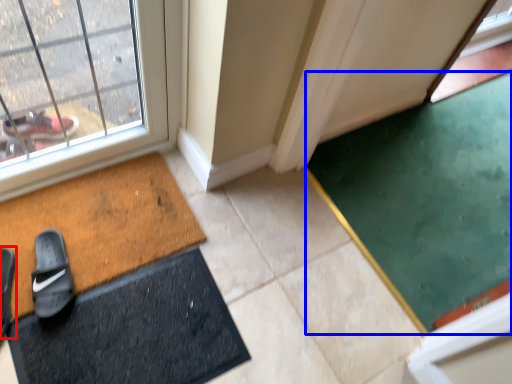
Question: Which point is further to the camera, footwear (highlighted by a red box) or doormat (highlighted by a blue box)?

Choices:
 (A) footwear
 (B) doormat

Answer: (B)